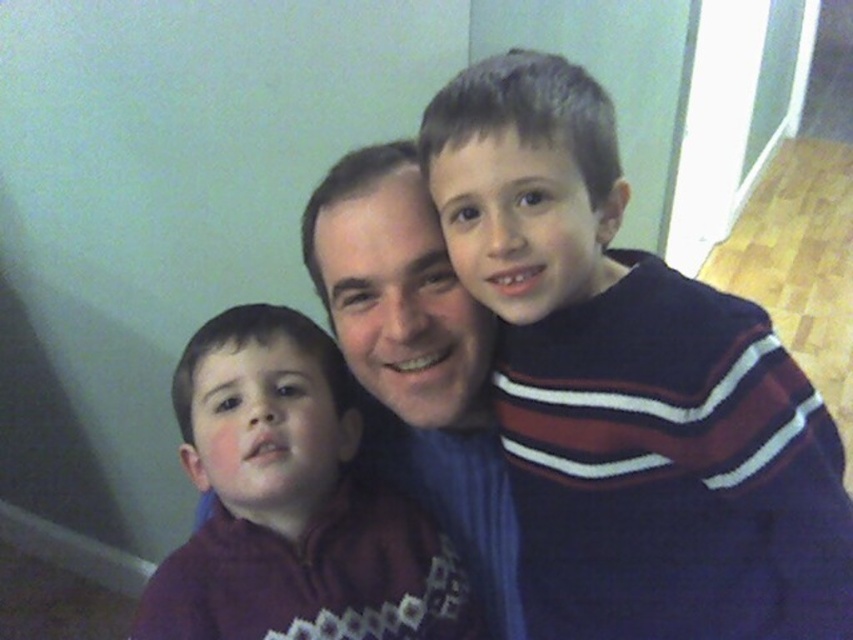
Consider the image. Can you confirm if dark blue sweater at right is smaller than purple fleece jacket at left?

No, dark blue sweater at right is not smaller than purple fleece jacket at left.

Does dark blue sweater at right appear over purple fleece jacket at left?

Correct, dark blue sweater at right is located above purple fleece jacket at left.

Between point (509, 77) and point (390, 508), which one is positioned in front?

Point (509, 77)

This screenshot has height=640, width=853. I want to click on dark blue sweater at right, so click(x=630, y=388).

Is point (554, 282) positioned before point (450, 314)?

Yes, it is.

Which is in front, point (689, 518) or point (431, 390)?

Point (689, 518) is more forward.

The image size is (853, 640). Find the location of `dark blue sweater at right`. dark blue sweater at right is located at coordinates (630, 388).

Can you confirm if purple fleece jacket at left is thinner than matte blue sweater at center?

No.

Consider the image. Does purple fleece jacket at left have a smaller size compared to matte blue sweater at center?

Yes, purple fleece jacket at left is smaller than matte blue sweater at center.

Measure the distance between point (x=311, y=515) and camera.

The distance of point (x=311, y=515) from camera is 36.20 inches.

The height and width of the screenshot is (640, 853). Find the location of `purple fleece jacket at left`. purple fleece jacket at left is located at coordinates (293, 502).